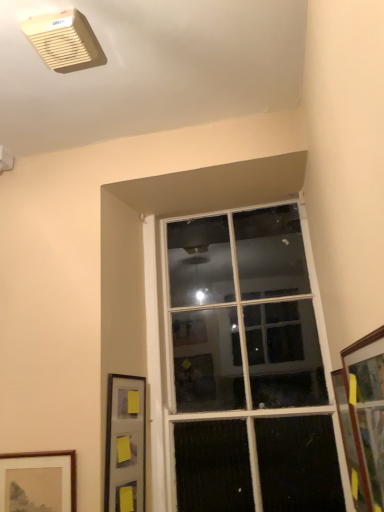
What do you see at coordinates (125, 444) in the screenshot? I see `matte gray picture frame at lower left, the second picture frame positioned from the right` at bounding box center [125, 444].

Find the location of a particular element. The width and height of the screenshot is (384, 512). wooden picture frame at right, the third picture frame positioned from the left is located at coordinates (367, 410).

What do you see at coordinates (38, 481) in the screenshot? I see `wooden framed picture at lower left, acting as the first picture frame starting from the left` at bounding box center [38, 481].

Identify the location of clear glass window at center. The width and height of the screenshot is (384, 512). (247, 366).

Measure the distance between point (218,286) and camera.

Point (218,286) is 6.27 feet from camera.

Find the location of a particular element. beige plastic air conditioning unit at upper left is located at coordinates (64, 41).

Identify the location of matte gray picture frame at lower left, which appears as the third picture frame when viewed from the front. Image resolution: width=384 pixels, height=512 pixels. (125, 444).

From a real-world perspective, is wooden framed picture at lower left, acting as the first picture frame starting from the left, below beige plastic air conditioning unit at upper left?

Indeed, from a real-world perspective, wooden framed picture at lower left, acting as the first picture frame starting from the left, is positioned beneath beige plastic air conditioning unit at upper left.

Are wooden framed picture at lower left, which is counted as the 2th picture frame, starting from the back, and beige plastic air conditioning unit at upper left far apart?

wooden framed picture at lower left, which is counted as the 2th picture frame, starting from the back, is far away from beige plastic air conditioning unit at upper left.

Locate an element on the screen. The width and height of the screenshot is (384, 512). air conditioning in front of the wooden framed picture at lower left, the third picture frame when ordered from right to left is located at coordinates (64, 41).

Measure the distance from wooden framed picture at lower left, which is counted as the 2th picture frame, starting from the back, to beige plastic air conditioning unit at upper left.

wooden framed picture at lower left, which is counted as the 2th picture frame, starting from the back, and beige plastic air conditioning unit at upper left are 4.29 feet apart from each other.

Which is more to the left, beige plastic air conditioning unit at upper left or wooden framed picture at lower left, which is counted as the 2th picture frame, starting from the back?

From the viewer's perspective, wooden framed picture at lower left, which is counted as the 2th picture frame, starting from the back, appears more on the left side.

From the image's perspective, is beige plastic air conditioning unit at upper left on top of wooden framed picture at lower left, the third picture frame when ordered from right to left?

Yes, from the image's perspective, beige plastic air conditioning unit at upper left is over wooden framed picture at lower left, the third picture frame when ordered from right to left.

Is beige plastic air conditioning unit at upper left not inside wooden framed picture at lower left, the 2th picture frame when ordered from front to back?

beige plastic air conditioning unit at upper left lies outside wooden framed picture at lower left, the 2th picture frame when ordered from front to back,'s area.

Between beige plastic air conditioning unit at upper left and wooden framed picture at lower left, the 2th picture frame when ordered from front to back, which one has less height?

beige plastic air conditioning unit at upper left is shorter.

Looking at the image, does wooden picture frame at right, which is the 1th picture frame from front to back, seem bigger or smaller compared to wooden framed picture at lower left, acting as the first picture frame starting from the left?

Clearly, wooden picture frame at right, which is the 1th picture frame from front to back, is larger in size than wooden framed picture at lower left, acting as the first picture frame starting from the left.

Is wooden framed picture at lower left, the 2th picture frame when ordered from front to back, at the back of wooden picture frame at right, which is the 1th picture frame from front to back?

No, wooden picture frame at right, which is the 1th picture frame from front to back, is not facing the opposite direction of wooden framed picture at lower left, the 2th picture frame when ordered from front to back.

Would you consider wooden picture frame at right, the third picture frame positioned from the left, to be distant from wooden framed picture at lower left, which is counted as the 2th picture frame, starting from the back?

wooden picture frame at right, the third picture frame positioned from the left, is actually quite close to wooden framed picture at lower left, which is counted as the 2th picture frame, starting from the back.

Looking at this image, which of these two, wooden picture frame at right, the 3th picture frame from the back, or wooden framed picture at lower left, the 2th picture frame when ordered from front to back, is wider?

With larger width is wooden picture frame at right, the 3th picture frame from the back.

Can you confirm if matte gray picture frame at lower left, which appears as the third picture frame when viewed from the front, is smaller than beige plastic air conditioning unit at upper left?

No.

From a real-world perspective, does matte gray picture frame at lower left, positioned as the second picture frame in left-to-right order, stand above beige plastic air conditioning unit at upper left?

No.

Which of these two, matte gray picture frame at lower left, positioned as the second picture frame in left-to-right order, or beige plastic air conditioning unit at upper left, stands shorter?

Standing shorter between the two is beige plastic air conditioning unit at upper left.

Is matte gray picture frame at lower left, positioned as the second picture frame in left-to-right order, at the left side of beige plastic air conditioning unit at upper left?

No.

Is wooden framed picture at lower left, the 2th picture frame when ordered from front to back, closer to the viewer compared to matte gray picture frame at lower left, the 1th picture frame viewed from the back?

Yes, the depth of wooden framed picture at lower left, the 2th picture frame when ordered from front to back, is less than that of matte gray picture frame at lower left, the 1th picture frame viewed from the back.

Between point (39, 507) and point (145, 429), which one is positioned behind?

Point (145, 429)

From a real-world perspective, who is located lower, wooden framed picture at lower left, acting as the first picture frame starting from the left, or matte gray picture frame at lower left, the 1th picture frame viewed from the back?

wooden framed picture at lower left, acting as the first picture frame starting from the left.

Is wooden framed picture at lower left, the 2th picture frame when ordered from front to back, next to matte gray picture frame at lower left, the 1th picture frame viewed from the back?

wooden framed picture at lower left, the 2th picture frame when ordered from front to back, is not next to matte gray picture frame at lower left, the 1th picture frame viewed from the back, and they're not touching.

From the image's perspective, is matte gray picture frame at lower left, which appears as the third picture frame when viewed from the front, under wooden framed picture at lower left, acting as the first picture frame starting from the left?

Actually, matte gray picture frame at lower left, which appears as the third picture frame when viewed from the front, appears above wooden framed picture at lower left, acting as the first picture frame starting from the left, in the image.

Can you confirm if matte gray picture frame at lower left, positioned as the second picture frame in left-to-right order, is bigger than wooden framed picture at lower left, which is counted as the 2th picture frame, starting from the back?

Correct, matte gray picture frame at lower left, positioned as the second picture frame in left-to-right order, is larger in size than wooden framed picture at lower left, which is counted as the 2th picture frame, starting from the back.

Which is in front, matte gray picture frame at lower left, the second picture frame positioned from the right, or wooden framed picture at lower left, acting as the first picture frame starting from the left?

Positioned in front is wooden framed picture at lower left, acting as the first picture frame starting from the left.

Is clear glass window at center further to the viewer compared to beige plastic air conditioning unit at upper left?

That is True.

Do you think clear glass window at center is within beige plastic air conditioning unit at upper left, or outside of it?

clear glass window at center is not enclosed by beige plastic air conditioning unit at upper left.

Which of these two, clear glass window at center or beige plastic air conditioning unit at upper left, stands shorter?

beige plastic air conditioning unit at upper left is shorter.

From the image's perspective, is clear glass window at center below beige plastic air conditioning unit at upper left?

Yes.

Locate an element on the screen. the 3rd picture frame positioned below the beige plastic air conditioning unit at upper left (from a real-world perspective) is located at coordinates (38, 481).

The height and width of the screenshot is (512, 384). In order to click on air conditioning lying on the right of wooden framed picture at lower left, the 2th picture frame when ordered from front to back in this screenshot , I will do `click(64, 41)`.

From the image, which object appears to be farther from wooden picture frame at right, arranged as the 1th picture frame when viewed from the right, beige plastic air conditioning unit at upper left or wooden framed picture at lower left, acting as the first picture frame starting from the left?

beige plastic air conditioning unit at upper left is positioned further to the anchor wooden picture frame at right, arranged as the 1th picture frame when viewed from the right.

From the image, which object appears to be nearer to wooden picture frame at right, arranged as the 1th picture frame when viewed from the right, clear glass window at center or matte gray picture frame at lower left, the second picture frame positioned from the right?

clear glass window at center lies closer to wooden picture frame at right, arranged as the 1th picture frame when viewed from the right, than the other object.

When comparing their distances from wooden picture frame at right, which is the 1th picture frame from front to back, does clear glass window at center or beige plastic air conditioning unit at upper left seem closer?

clear glass window at center is closer to wooden picture frame at right, which is the 1th picture frame from front to back.

Estimate the real-world distances between objects in this image. Which object is closer to wooden framed picture at lower left, which is counted as the 2th picture frame, starting from the back, matte gray picture frame at lower left, the second picture frame positioned from the right, or wooden picture frame at right, the 3th picture frame from the back?

matte gray picture frame at lower left, the second picture frame positioned from the right, is closer to wooden framed picture at lower left, which is counted as the 2th picture frame, starting from the back.

When comparing their distances from wooden framed picture at lower left, acting as the first picture frame starting from the left, does clear glass window at center or beige plastic air conditioning unit at upper left seem closer?

Among the two, clear glass window at center is located nearer to wooden framed picture at lower left, acting as the first picture frame starting from the left.

Based on their spatial positions, is clear glass window at center or wooden picture frame at right, the 3th picture frame from the back, further from wooden framed picture at lower left, the 2th picture frame when ordered from front to back?

Based on the image, wooden picture frame at right, the 3th picture frame from the back, appears to be further to wooden framed picture at lower left, the 2th picture frame when ordered from front to back.

When comparing their distances from wooden framed picture at lower left, which is counted as the 2th picture frame, starting from the back, does wooden picture frame at right, the 3th picture frame from the back, or clear glass window at center seem further?

wooden picture frame at right, the 3th picture frame from the back, is further to wooden framed picture at lower left, which is counted as the 2th picture frame, starting from the back.

From the image, which object appears to be nearer to wooden framed picture at lower left, the 2th picture frame when ordered from front to back, matte gray picture frame at lower left, the 1th picture frame viewed from the back, or beige plastic air conditioning unit at upper left?

matte gray picture frame at lower left, the 1th picture frame viewed from the back.

What are the coordinates of `picture frame between wooden framed picture at lower left, acting as the first picture frame starting from the left, and clear glass window at center` in the screenshot? It's located at (125, 444).

Find the location of `window between beige plastic air conditioning unit at upper left and matte gray picture frame at lower left, the second picture frame positioned from the right, in the up-down direction`. window between beige plastic air conditioning unit at upper left and matte gray picture frame at lower left, the second picture frame positioned from the right, in the up-down direction is located at coordinates (247, 366).

Where is `picture frame between wooden framed picture at lower left, the 2th picture frame when ordered from front to back, and wooden picture frame at right, the third picture frame positioned from the left`? This screenshot has height=512, width=384. picture frame between wooden framed picture at lower left, the 2th picture frame when ordered from front to back, and wooden picture frame at right, the third picture frame positioned from the left is located at coordinates (125, 444).

Find the location of a particular element. picture frame between beige plastic air conditioning unit at upper left and clear glass window at center from top to bottom is located at coordinates (367, 410).